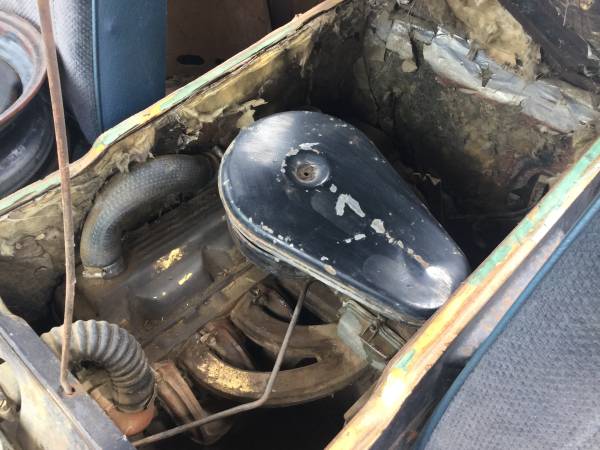
Find the location of `cushion piping`. cushion piping is located at coordinates (487, 342), (96, 53).